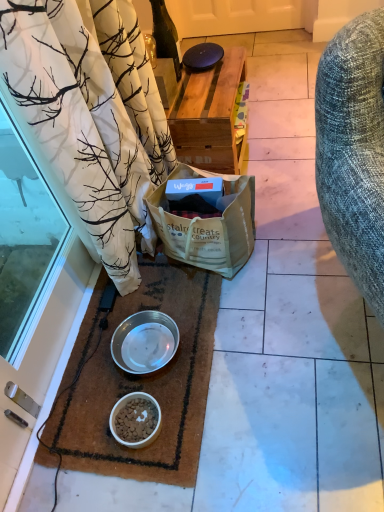
Identify the location of blank space to the left of white cardboard box at center. (139, 292).